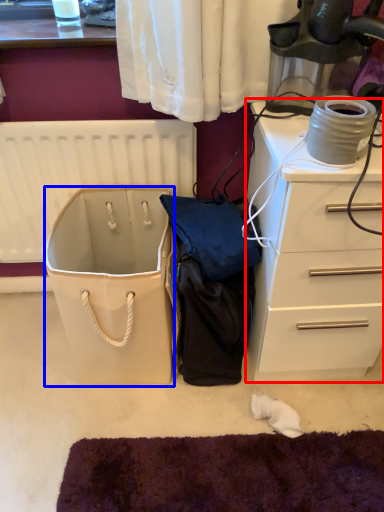
Question: Which point is further to the camera, chest of drawers (highlighted by a red box) or wide (highlighted by a blue box)?

Choices:
 (A) chest of drawers
 (B) wide

Answer: (B)